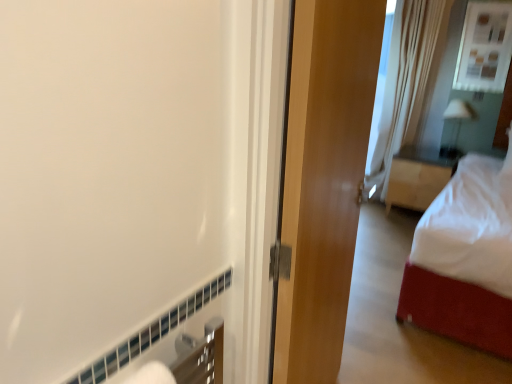
Question: Can you confirm if white glossy lamp at upper right is thinner than glossy wood door at center?

Choices:
 (A) yes
 (B) no

Answer: (B)

Question: Can you confirm if white glossy lamp at upper right is positioned to the left of glossy wood door at center?

Choices:
 (A) yes
 (B) no

Answer: (B)

Question: Can you confirm if white glossy lamp at upper right is bigger than glossy wood door at center?

Choices:
 (A) no
 (B) yes

Answer: (A)

Question: Can you confirm if white glossy lamp at upper right is smaller than glossy wood door at center?

Choices:
 (A) no
 (B) yes

Answer: (B)

Question: Is white glossy lamp at upper right aimed at glossy wood door at center?

Choices:
 (A) yes
 (B) no

Answer: (A)

Question: Would you say white soft bed at right is inside or outside matte glass window at upper right?

Choices:
 (A) inside
 (B) outside

Answer: (B)

Question: In terms of height, does white soft bed at right look taller or shorter compared to matte glass window at upper right?

Choices:
 (A) short
 (B) tall

Answer: (B)

Question: From a real-world perspective, is white soft bed at right physically located above or below matte glass window at upper right?

Choices:
 (A) above
 (B) below

Answer: (B)

Question: Considering the positions of white soft bed at right and matte glass window at upper right in the image, is white soft bed at right bigger or smaller than matte glass window at upper right?

Choices:
 (A) small
 (B) big

Answer: (B)

Question: From the image's perspective, relative to matte glass window at upper right, is glossy wood door at center above or below?

Choices:
 (A) below
 (B) above

Answer: (A)

Question: From a real-world perspective, is glossy wood door at center positioned above or below matte glass window at upper right?

Choices:
 (A) above
 (B) below

Answer: (B)

Question: Is glossy wood door at center in front of or behind matte glass window at upper right in the image?

Choices:
 (A) behind
 (B) front

Answer: (B)

Question: Is glossy wood door at center spatially inside matte glass window at upper right, or outside of it?

Choices:
 (A) inside
 (B) outside

Answer: (B)

Question: Considering the positions of point (276, 350) and point (426, 200), is point (276, 350) closer or farther from the camera than point (426, 200)?

Choices:
 (A) closer
 (B) farther

Answer: (A)

Question: Is glossy wood door at center situated inside wooden nightstand at right or outside?

Choices:
 (A) outside
 (B) inside

Answer: (A)